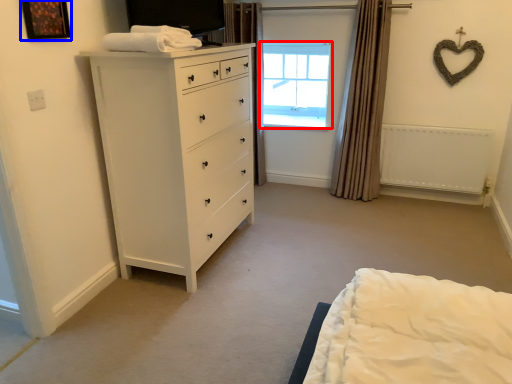
Question: Which object appears farthest to the camera in this image, window (highlighted by a red box) or picture frame (highlighted by a blue box)?

Choices:
 (A) window
 (B) picture frame

Answer: (A)